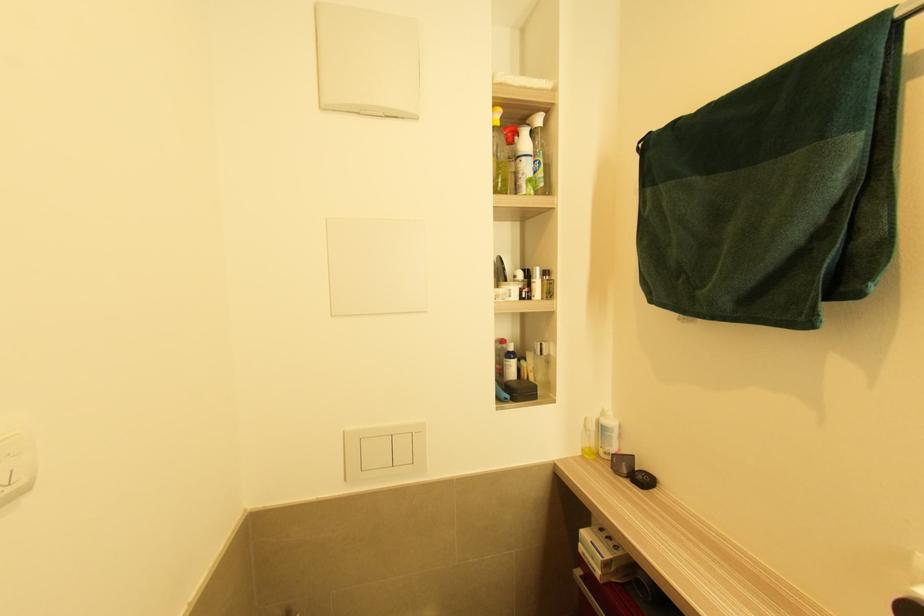
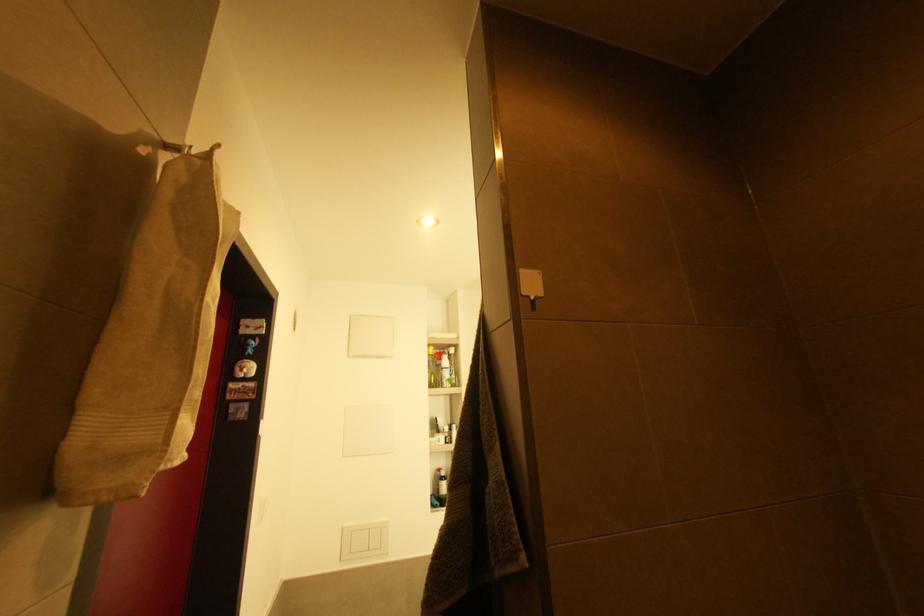
Question: In a continuous first-person perspective shot, in which direction is the camera moving?

Choices:
 (A) Left
 (B) Right
 (C) Forward
 (D) Backward

Answer: (D)